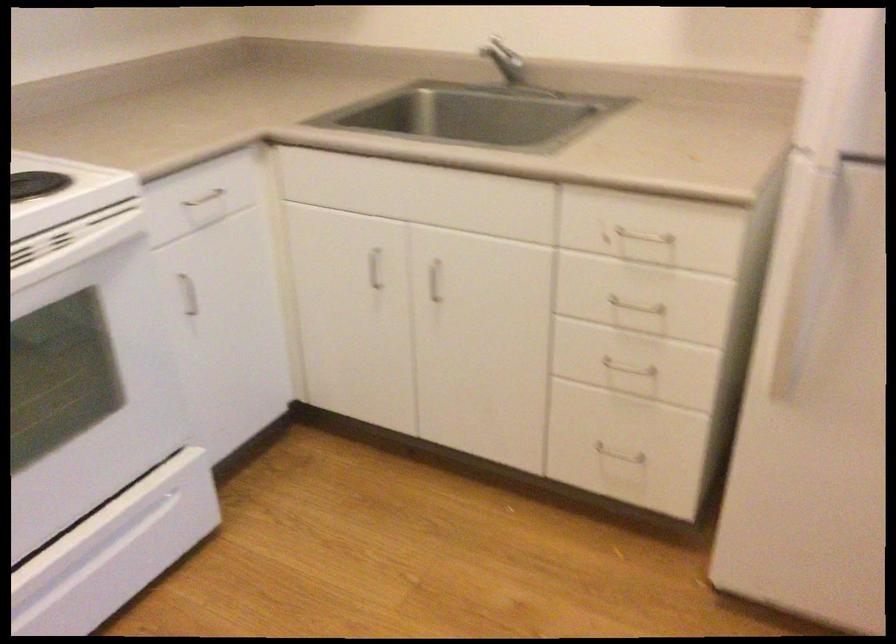
This screenshot has height=644, width=896. In order to click on silver faucet handle in this screenshot , I will do `click(510, 68)`.